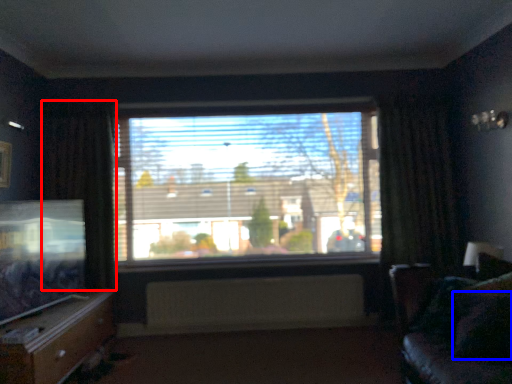
Question: Which of the following is the farthest to the observer, curtain (highlighted by a red box) or pillow (highlighted by a blue box)?

Choices:
 (A) curtain
 (B) pillow

Answer: (A)